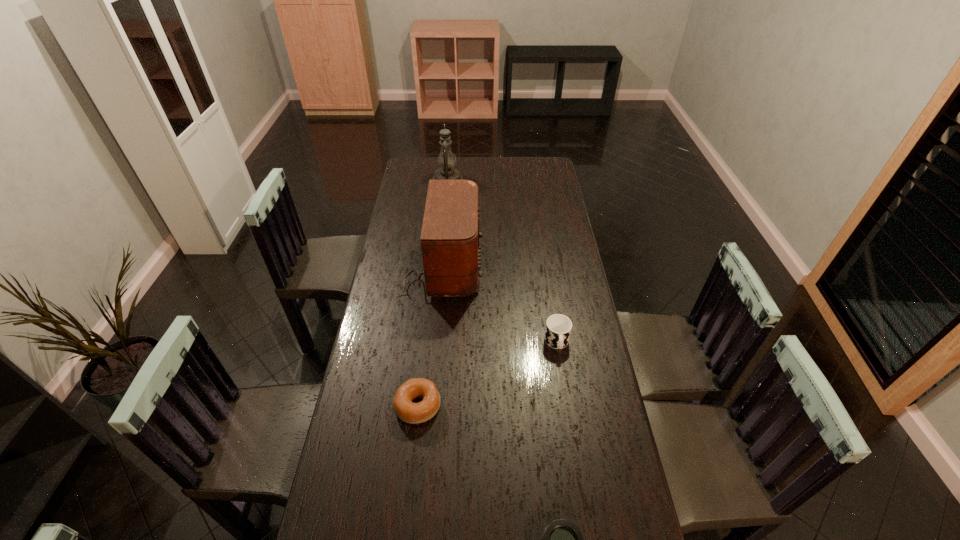
Where is `object that stands as the sixth closest to the carton`? Image resolution: width=960 pixels, height=540 pixels. object that stands as the sixth closest to the carton is located at coordinates (420, 342).

Identify which sunflower is located as the fifth nearest to the biggest green sunflower. Please provide its 2D coordinates. Your answer should be formatted as a tuple, i.e. [(x, y)], where the tuple contains the x and y coordinates of a point satisfying the conditions above.

[(451, 490)]

Where is `sunflower that stands as the fourth closest to the second smallest green sunflower`? The height and width of the screenshot is (540, 960). sunflower that stands as the fourth closest to the second smallest green sunflower is located at coordinates (555, 216).

Identify which yellow sunflower is located as the second nearest to the nearest object. Please provide its 2D coordinates. Your answer should be formatted as a tuple, i.e. [(x, y)], where the tuple contains the x and y coordinates of a point satisfying the conditions above.

[(487, 207)]

Select which yellow sunflower appears as the third closest to the nearest sunflower. Please provide its 2D coordinates. Your answer should be formatted as a tuple, i.e. [(x, y)], where the tuple contains the x and y coordinates of a point satisfying the conditions above.

[(555, 216)]

You are a GUI agent. You are given a task and a screenshot of the screen. Output one action in this format:
    pyautogui.click(x=<x>, y=<y>)
    Task: Click on the closest green sunflower to the biggest green sunflower
    The height and width of the screenshot is (540, 960).
    Given the screenshot: What is the action you would take?
    (420, 342)

Where is `the closest green sunflower relative to the carton`? The image size is (960, 540). the closest green sunflower relative to the carton is located at coordinates (425, 157).